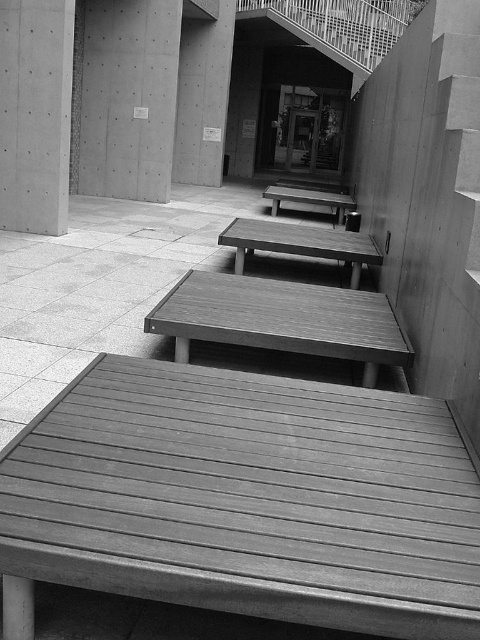
Question: Can you confirm if wooden table at center is wider than wooden bench at center?

Choices:
 (A) no
 (B) yes

Answer: (A)

Question: Does wooden table at center have a larger size compared to wooden park bench at center?

Choices:
 (A) no
 (B) yes

Answer: (A)

Question: Which is nearer to the smooth concrete pillar at upper left?

Choices:
 (A) wooden park bench at center
 (B) wooden bench at center
 (C) wooden table at center

Answer: (B)

Question: Among these points, which one is farthest from the camera?

Choices:
 (A) (382, 257)
 (B) (31, 141)
 (C) (388, 580)

Answer: (B)

Question: Which object is positioned closest to the wooden bench at center?

Choices:
 (A) wooden table at center
 (B) wooden park bench at center
 (C) wooden table at lower center
 (D) smooth concrete pillar at upper left

Answer: (A)

Question: From the image, what is the correct spatial relationship of wooden table at lower center in relation to smooth concrete pillar at upper left?

Choices:
 (A) right
 (B) left

Answer: (A)